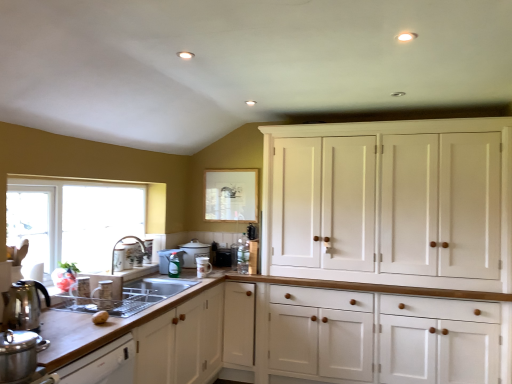
Identify the location of unoccupied space behind brown matte potato at lower left. coord(103,309).